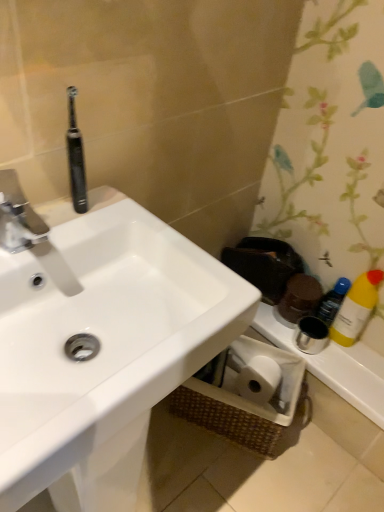
Where is `free location in front of black rubber toothbrush at upper left`? Image resolution: width=384 pixels, height=512 pixels. free location in front of black rubber toothbrush at upper left is located at coordinates (67, 232).